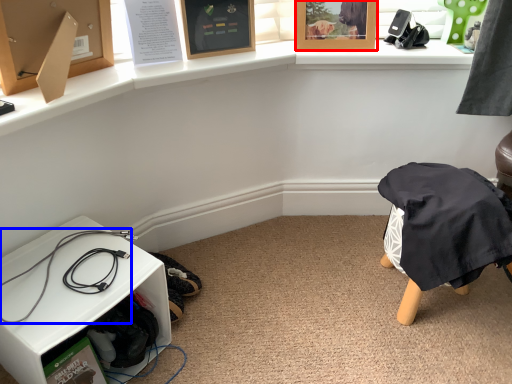
Question: Which object is closer to the camera taking this photo, picture frame (highlighted by a red box) or wire (highlighted by a blue box)?

Choices:
 (A) picture frame
 (B) wire

Answer: (B)